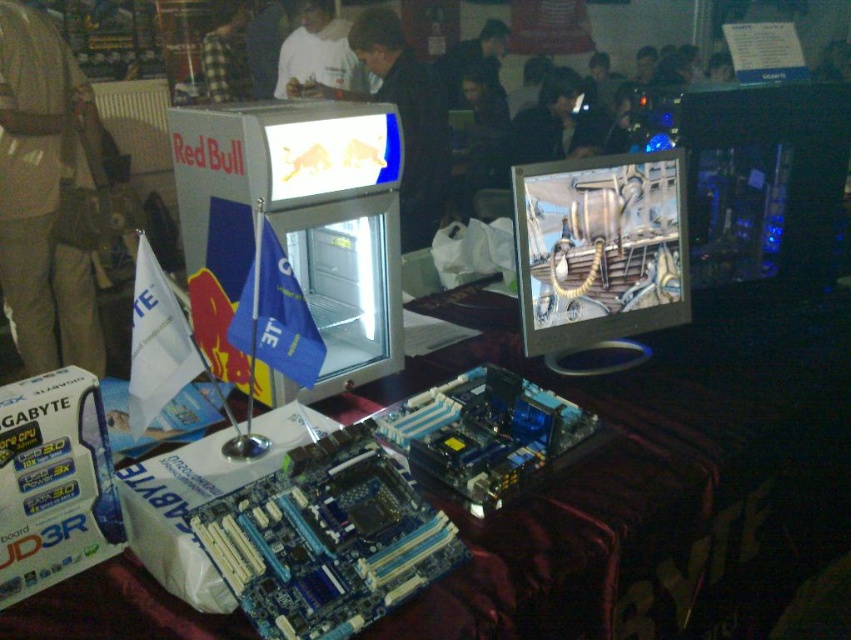
Is shiny blue motherboard at center bigger than tan fabric bag at center?

Indeed, shiny blue motherboard at center has a larger size compared to tan fabric bag at center.

Does point (769, 566) come in front of point (41, 209)?

Yes, point (769, 566) is closer to viewer.

Where is `shiny blue motherboard at center`? shiny blue motherboard at center is located at coordinates (654, 481).

Between shiny blue motherboard at center and checkered fabric shirt at upper center, which one appears on the right side from the viewer's perspective?

Positioned to the right is shiny blue motherboard at center.

Does point (818, 308) come in front of point (216, 20)?

Yes, it is in front of point (216, 20).

You are a GUI agent. You are given a task and a screenshot of the screen. Output one action in this format:
    pyautogui.click(x=<x>, y=<y>)
    Task: Click on the shiny blue motherboard at center
    Image resolution: width=851 pixels, height=640 pixels.
    Given the screenshot: What is the action you would take?
    pyautogui.click(x=654, y=481)

Find the location of a particular element. The width and height of the screenshot is (851, 640). shiny blue motherboard at center is located at coordinates (654, 481).

Who is lower down, matte black monitor at center or checkered fabric shirt at upper center?

matte black monitor at center

Is point (786, 157) closer to camera compared to point (220, 81)?

Yes, it is.

Measure the distance between point (717, 307) and camera.

Point (717, 307) and camera are 1.89 meters apart from each other.

The image size is (851, 640). I want to click on matte black monitor at center, so click(763, 189).